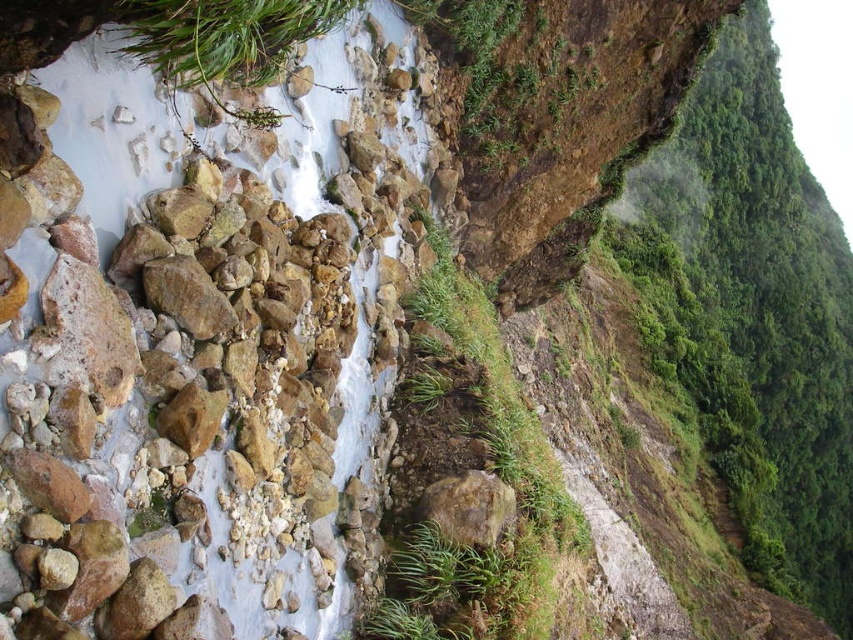
Question: Does green leafy vegetation at upper right have a greater width compared to rusty metallic rock at center?

Choices:
 (A) yes
 (B) no

Answer: (A)

Question: Which object is farther from the camera taking this photo?

Choices:
 (A) green leafy vegetation at upper right
 (B) rusty metallic rock at center

Answer: (A)

Question: Can you confirm if green leafy vegetation at upper right is positioned below rusty metallic rock at center?

Choices:
 (A) yes
 (B) no

Answer: (B)

Question: Is green leafy vegetation at upper right to the left of rusty metallic rock at center from the viewer's perspective?

Choices:
 (A) no
 (B) yes

Answer: (A)